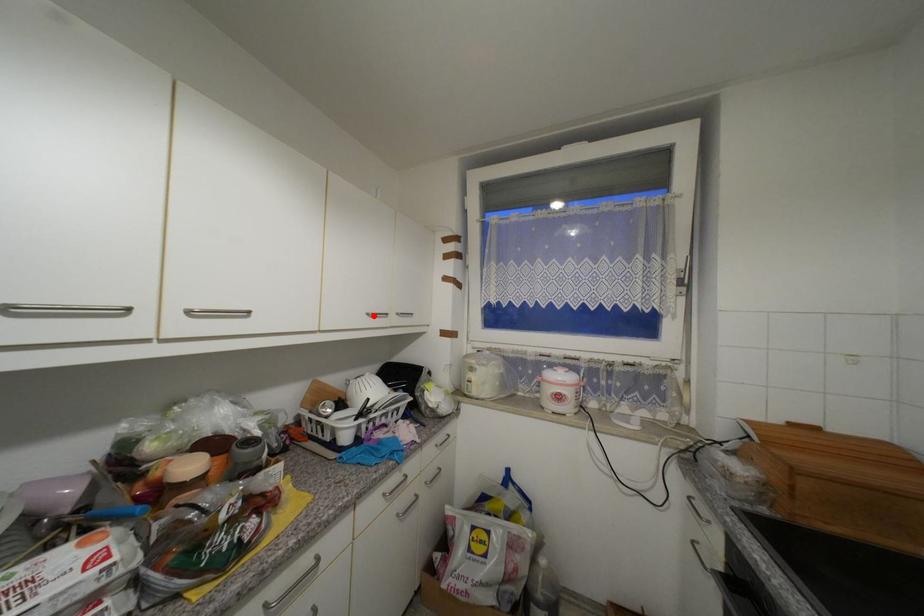
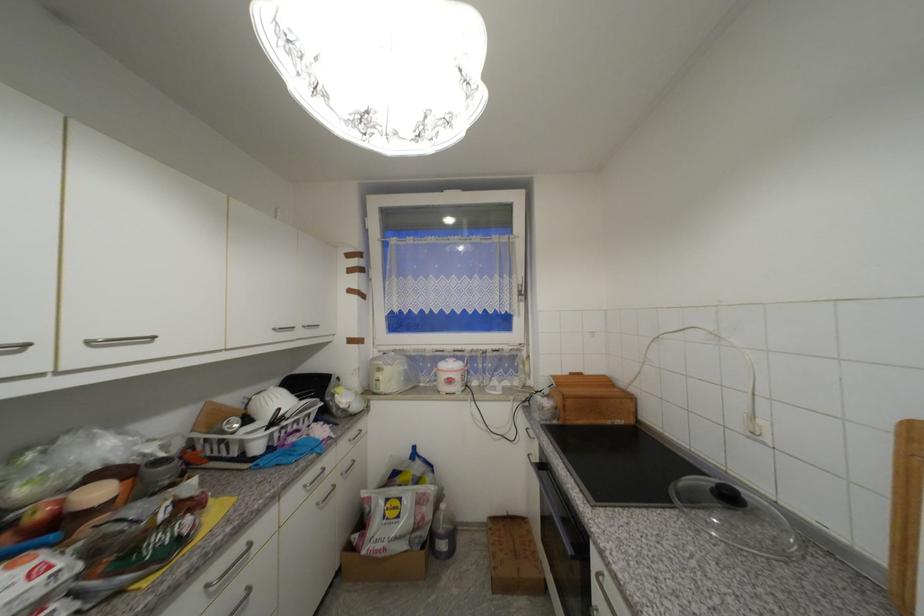
In the second image, find the point that corresponds to the highlighted location in the first image.

(281, 331)